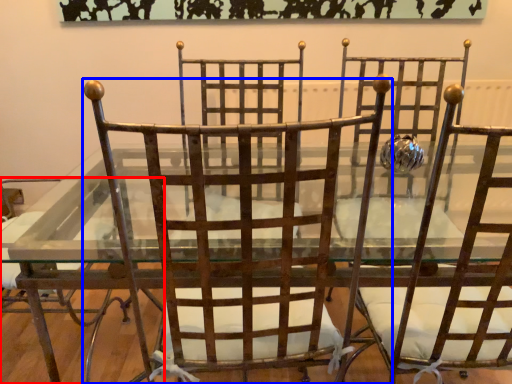
Question: Which point is further to the camera, chair (highlighted by a red box) or chair (highlighted by a blue box)?

Choices:
 (A) chair
 (B) chair

Answer: (A)